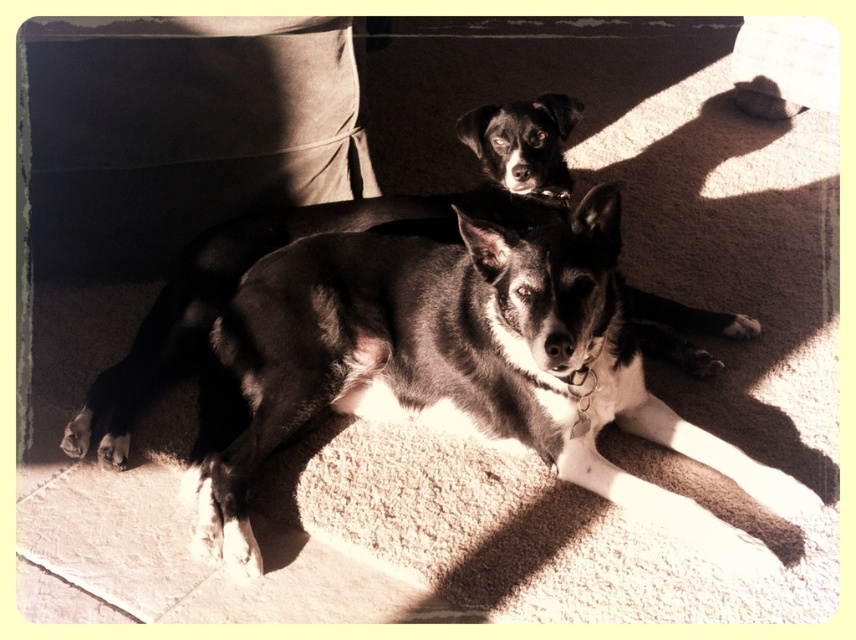
What do you see at coordinates (464, 365) in the screenshot? The width and height of the screenshot is (856, 640). I see `shiny black fur at center` at bounding box center [464, 365].

Does point (259, 307) lie behind point (670, 337)?

No, it is not.

Between point (322, 408) and point (642, 317), which one is positioned behind?

Point (642, 317)

Find the location of `shiny black fur at center`. shiny black fur at center is located at coordinates (464, 365).